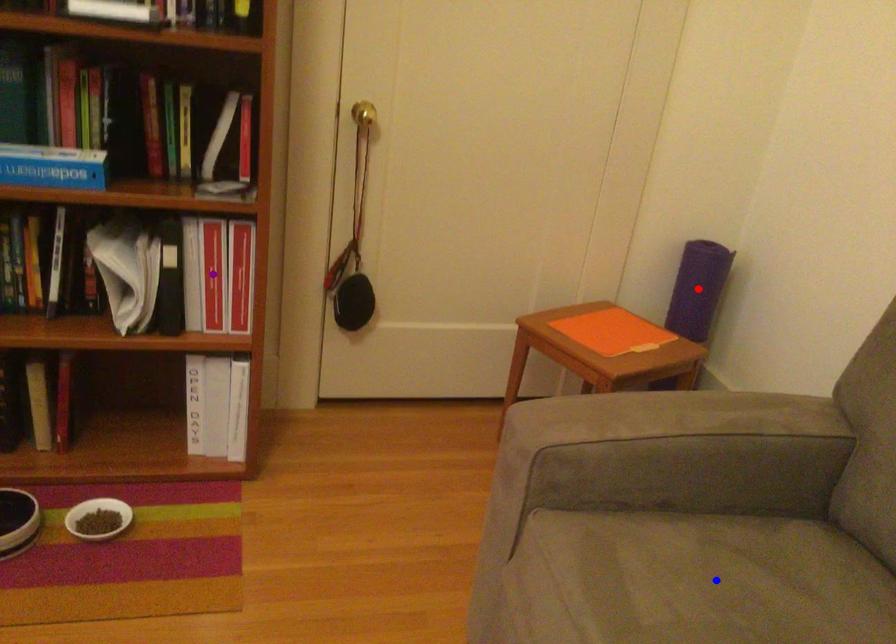
Order these from farthest to nearest:
purple point, blue point, red point

red point < purple point < blue point